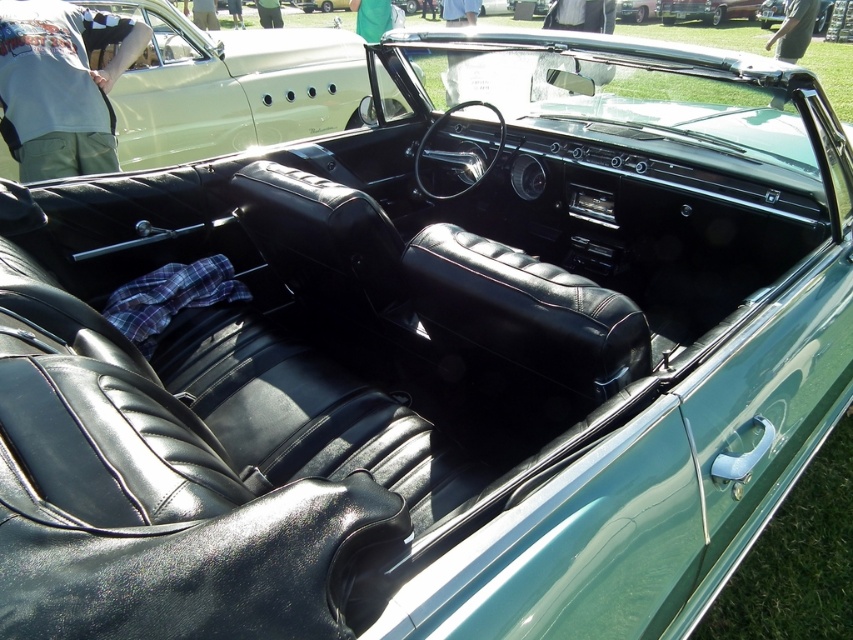
Can you confirm if shiny silver car at upper center is positioned to the right of green leather convertible at upper center?

No, shiny silver car at upper center is not to the right of green leather convertible at upper center.

Describe the element at coordinates (705, 10) in the screenshot. I see `shiny silver car at upper center` at that location.

Image resolution: width=853 pixels, height=640 pixels. I want to click on shiny silver car at upper center, so click(x=705, y=10).

Does matte black leather seats at center have a lesser height compared to shiny silver car at upper center?

In fact, matte black leather seats at center may be taller than shiny silver car at upper center.

Is the position of matte black leather seats at center more distant than that of shiny silver car at upper center?

That is False.

Is point (241, 141) in front of point (654, 8)?

Yes.

You are a GUI agent. You are given a task and a screenshot of the screen. Output one action in this format:
    pyautogui.click(x=<x>, y=<y>)
    Task: Click on the matte black leather seats at center
    
    Given the screenshot: What is the action you would take?
    pyautogui.click(x=229, y=86)

Does point (172, 77) come behind point (814, 20)?

No.

Is point (148, 150) more distant than point (822, 16)?

No.

Image resolution: width=853 pixels, height=640 pixels. Find the location of `matte black leather seats at center`. matte black leather seats at center is located at coordinates (229, 86).